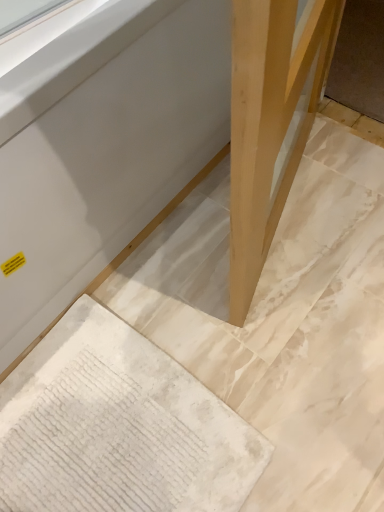
Question: From the image's perspective, is matte wood table at center under white textured rug at lower left?

Choices:
 (A) no
 (B) yes

Answer: (A)

Question: Is matte wood table at center wider than white textured rug at lower left?

Choices:
 (A) no
 (B) yes

Answer: (B)

Question: Is matte wood table at center shorter than white textured rug at lower left?

Choices:
 (A) yes
 (B) no

Answer: (B)

Question: Is matte wood table at center placed right next to white textured rug at lower left?

Choices:
 (A) yes
 (B) no

Answer: (B)

Question: From the image's perspective, is matte wood table at center over white textured rug at lower left?

Choices:
 (A) yes
 (B) no

Answer: (A)

Question: Is matte wood table at center bigger than white textured rug at lower left?

Choices:
 (A) yes
 (B) no

Answer: (A)

Question: Can we say natural wood leg at center lies outside white textured rug at lower left?

Choices:
 (A) yes
 (B) no

Answer: (A)

Question: Does natural wood leg at center come behind white textured rug at lower left?

Choices:
 (A) yes
 (B) no

Answer: (B)

Question: From the image's perspective, would you say natural wood leg at center is shown under white textured rug at lower left?

Choices:
 (A) no
 (B) yes

Answer: (A)

Question: Considering the relative sizes of natural wood leg at center and white textured rug at lower left in the image provided, is natural wood leg at center bigger than white textured rug at lower left?

Choices:
 (A) yes
 (B) no

Answer: (A)

Question: Is natural wood leg at center positioned far away from white textured rug at lower left?

Choices:
 (A) no
 (B) yes

Answer: (A)

Question: Considering the relative positions of natural wood leg at center and white textured rug at lower left in the image provided, is natural wood leg at center in front of white textured rug at lower left?

Choices:
 (A) no
 (B) yes

Answer: (B)

Question: From a real-world perspective, does white textured rug at lower left sit lower than natural wood leg at center?

Choices:
 (A) no
 (B) yes

Answer: (B)